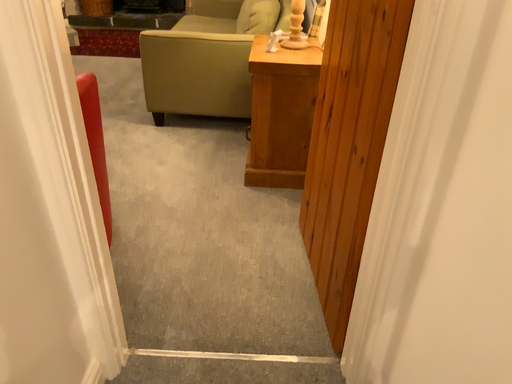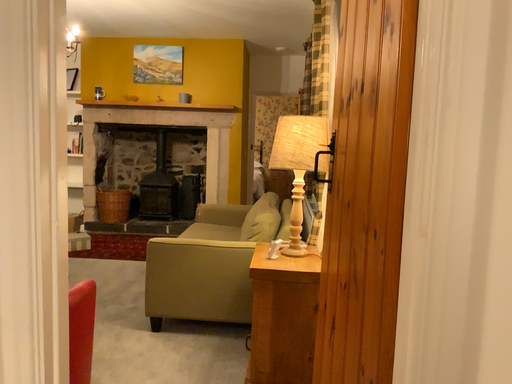
Question: Which way did the camera rotate in the video?

Choices:
 (A) rotated upward
 (B) rotated downward

Answer: (A)